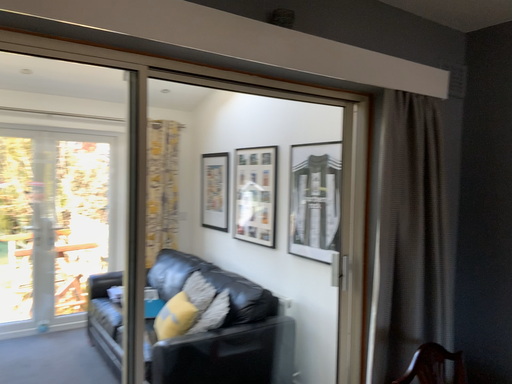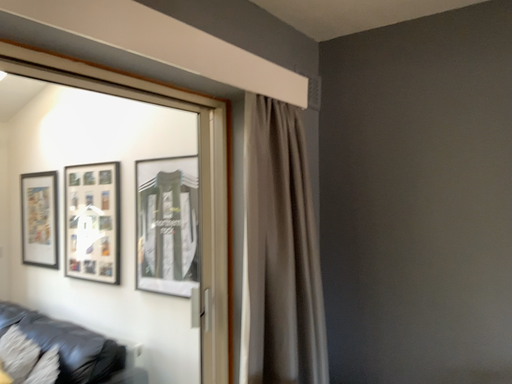
Question: How did the camera likely rotate when shooting the video?

Choices:
 (A) rotated right
 (B) rotated left

Answer: (A)